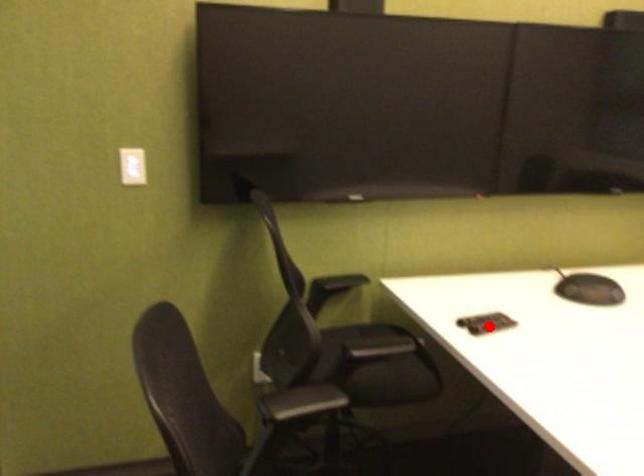
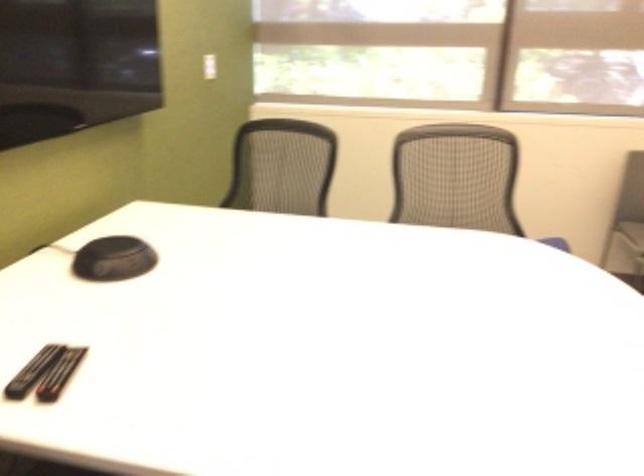
Where in the second image is the point corresponding to the highlighted location from the first image?

(59, 374)